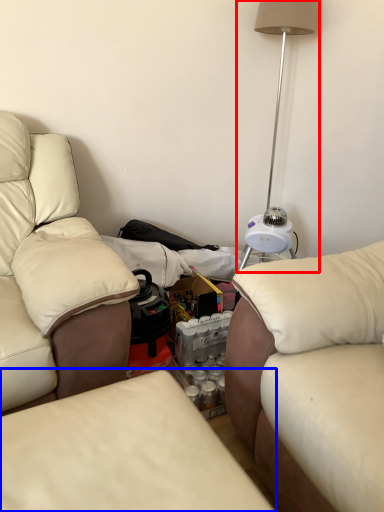
Question: Which of the following is the closest to the observer, table lamp (highlighted by a red box) or studio couch (highlighted by a blue box)?

Choices:
 (A) table lamp
 (B) studio couch

Answer: (B)